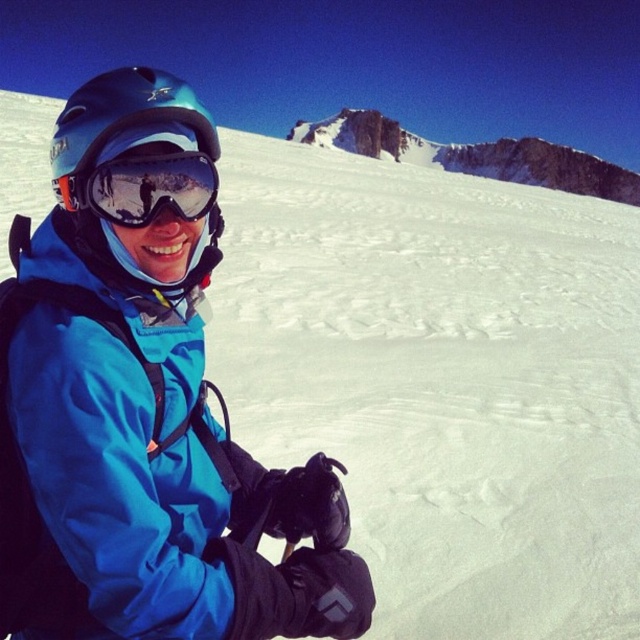
You are a photographer trying to capture the best angle of the snowy slope. You notice two points marked as point (500, 161) and point (60, 115). Which point is closer to your camera lens?

Point (500, 161) is further to the viewer than point (60, 115), so the point closer to the camera lens is point (60, 115).

You are a photographer trying to capture the reflection of the mountain peaks in the glossy reflective goggles at center. Since the matte blue helmet at left is blocking your view, can you move the helmet to the right to get a clear shot?

The matte blue helmet at left is taller than the glossy reflective goggles at center. Moving the matte blue helmet at left to the right might help, but since it is taller, it could still block the reflection depending on its new position.

You are a photographer standing at the base of the slope. You want to take a photo of the rugged stone mountain at upper center and the glossy reflective goggles at center in the same frame. Given that your camera has a maximum zoom range of 100 meters, can you capture both objects in a single shot without moving the camera?

The rugged stone mountain at upper center and glossy reflective goggles at center are 195.64 meters apart from each other. Since the distance between them exceeds the camera maximum zoom range of 100 meters, you cannot capture both objects in a single shot without moving the camera.